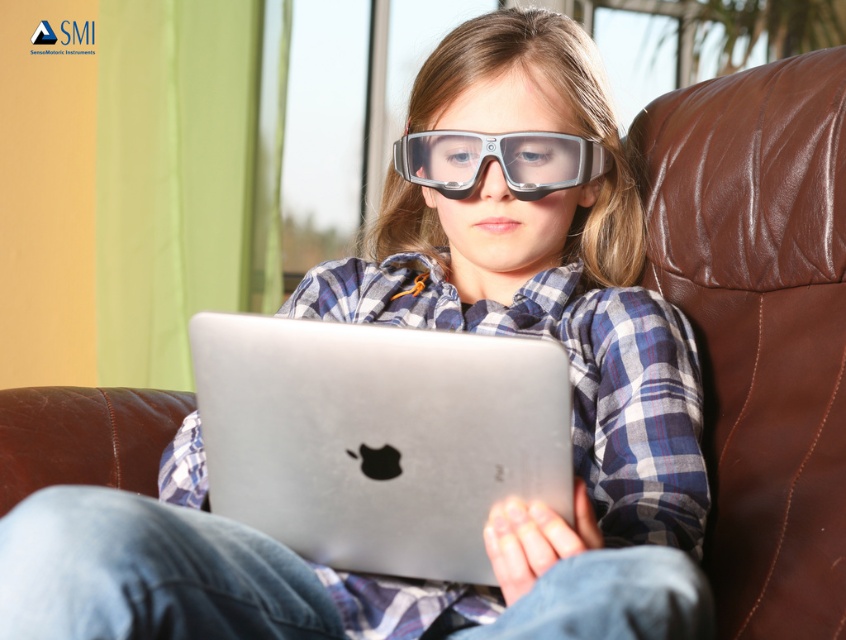
Which is in front, point (443, 467) or point (471, 168)?

Positioned in front is point (443, 467).

Does point (530, 417) come in front of point (580, 180)?

Yes, it is.

Is point (226, 358) less distant than point (443, 129)?

Yes, it is.

Where is `silver metallic laptop at center`? silver metallic laptop at center is located at coordinates (378, 436).